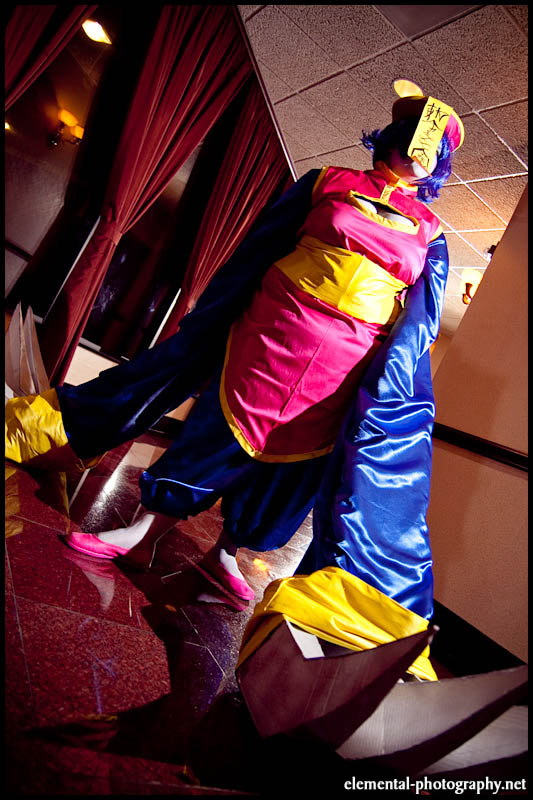
This screenshot has height=800, width=533. Find the location of `horizontal railing on wall`. horizontal railing on wall is located at coordinates (499, 450), (13, 245).